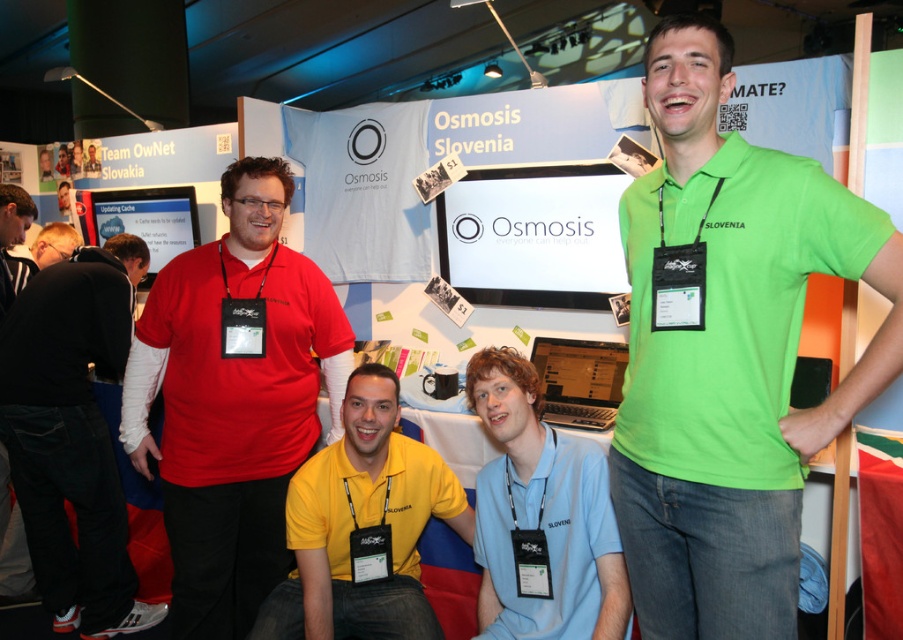
Who is taller, black fabric jacket at left or light blue fabric at center?

black fabric jacket at left

Is black fabric jacket at left shorter than light blue fabric at center?

In fact, black fabric jacket at left may be taller than light blue fabric at center.

Between point (58, 438) and point (531, 371), which one is positioned behind?

The point (58, 438) is behind.

Identify the location of black fabric jacket at left. The width and height of the screenshot is (903, 640). (72, 435).

Between green cotton shirt at center and light blue fabric at center, which one is positioned higher?

Positioned higher is green cotton shirt at center.

Is the position of green cotton shirt at center less distant than that of light blue fabric at center?

Yes, it is in front of light blue fabric at center.

Where is `green cotton shirt at center`? The image size is (903, 640). green cotton shirt at center is located at coordinates (731, 355).

Locate an element on the screen. This screenshot has width=903, height=640. green cotton shirt at center is located at coordinates (731, 355).

Which of these two, black fabric jacket at left or yellow matte shirt at center, stands taller?

With more height is black fabric jacket at left.

Does black fabric jacket at left lie behind yellow matte shirt at center?

Yes, it is behind yellow matte shirt at center.

Who is more distant from viewer, (71, 426) or (396, 584)?

The point (71, 426) is behind.

At what (x,y) coordinates should I click in order to perform the action: click on black fabric jacket at left. Please return your answer as a coordinate pair (x, y). Looking at the image, I should click on (72, 435).